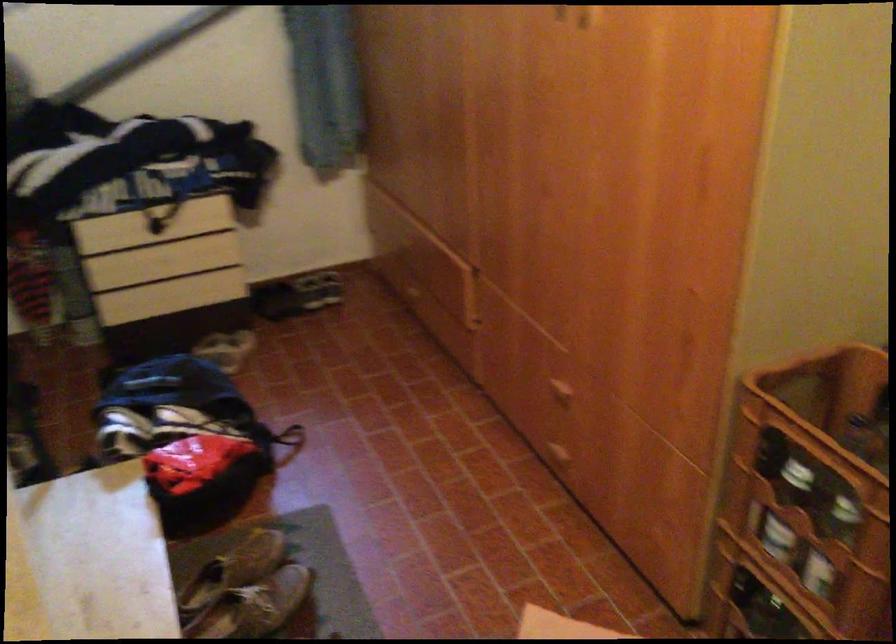
The first image is from the beginning of the video and the second image is from the end. How did the camera likely rotate when shooting the video?

The rotation direction of the camera is right-up.